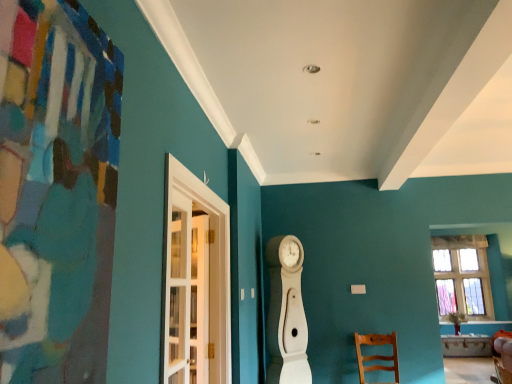
Question: Is wooden chair at lower right positioned behind white glass door at left?

Choices:
 (A) yes
 (B) no

Answer: (A)

Question: Would you consider wooden chair at lower right to be distant from white glass door at left?

Choices:
 (A) no
 (B) yes

Answer: (B)

Question: Is wooden chair at lower right positioned with its back to white glass door at left?

Choices:
 (A) no
 (B) yes

Answer: (A)

Question: From a real-world perspective, is wooden chair at lower right under white glass door at left?

Choices:
 (A) no
 (B) yes

Answer: (B)

Question: Is wooden chair at lower right shorter than white glass door at left?

Choices:
 (A) yes
 (B) no

Answer: (A)

Question: Is clear glass window at right situated inside white glass door at left or outside?

Choices:
 (A) inside
 (B) outside

Answer: (B)

Question: Considering their positions, is clear glass window at right located in front of or behind white glass door at left?

Choices:
 (A) front
 (B) behind

Answer: (B)

Question: Is point (484, 291) closer or farther from the camera than point (212, 236)?

Choices:
 (A) farther
 (B) closer

Answer: (A)

Question: Is clear glass window at right taller or shorter than white glass door at left?

Choices:
 (A) tall
 (B) short

Answer: (A)

Question: Does point (377, 355) appear closer or farther from the camera than point (465, 236)?

Choices:
 (A) closer
 (B) farther

Answer: (A)

Question: Is wooden chair at lower right taller or shorter than clear glass window at right?

Choices:
 (A) short
 (B) tall

Answer: (A)

Question: In the image, is wooden chair at lower right on the left side or the right side of clear glass window at right?

Choices:
 (A) right
 (B) left

Answer: (B)

Question: Do you think wooden chair at lower right is within clear glass window at right, or outside of it?

Choices:
 (A) inside
 (B) outside

Answer: (B)

Question: Is wooden chair at lower right spatially inside white glass door at left, or outside of it?

Choices:
 (A) outside
 (B) inside

Answer: (A)

Question: Is point (374, 370) closer or farther from the camera than point (188, 173)?

Choices:
 (A) farther
 (B) closer

Answer: (A)